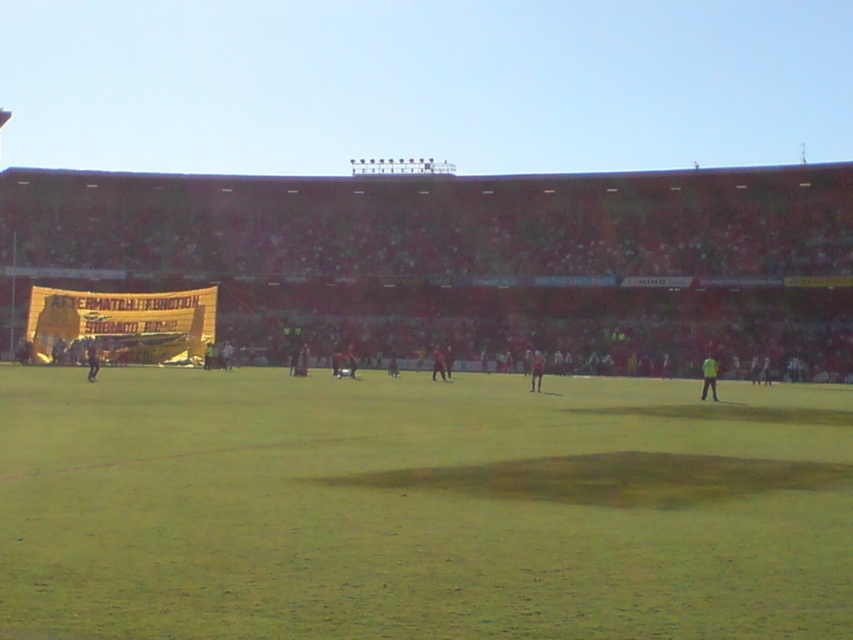
Question: Does green grass field at center appear on the right side of dark green jersey at left?

Choices:
 (A) no
 (B) yes

Answer: (B)

Question: Which of the following is the farthest from the observer?

Choices:
 (A) dark green jersey at left
 (B) red fabric person at center
 (C) green grass field at center
 (D) green matte person at center

Answer: (B)

Question: Can you confirm if red fabric person at center is positioned to the right of dark red jersey at center?

Choices:
 (A) no
 (B) yes

Answer: (B)

Question: Does red fabric person at center come in front of dark red jersey at center?

Choices:
 (A) yes
 (B) no

Answer: (A)

Question: Which object appears closest to the camera in this image?

Choices:
 (A) red fabric person at center
 (B) dark green jersey at left

Answer: (B)

Question: Which of the following is the farthest from the observer?

Choices:
 (A) dark red jersey at center
 (B) dark green jersey at left

Answer: (A)